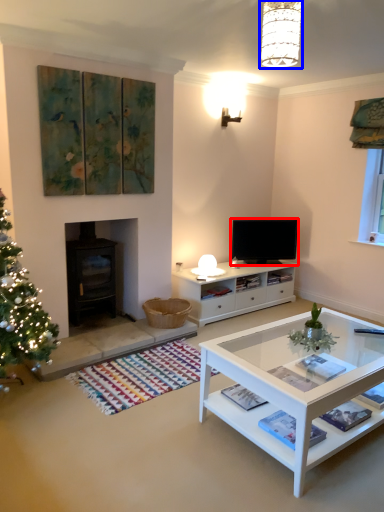
Question: Which point is further to the camera, television (highlighted by a red box) or lamp (highlighted by a blue box)?

Choices:
 (A) television
 (B) lamp

Answer: (A)